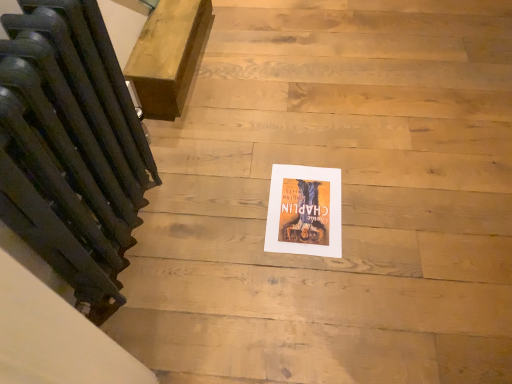
Question: Would you say matte paper poster at center is inside or outside matte black radiator at left?

Choices:
 (A) outside
 (B) inside

Answer: (A)

Question: Looking at the image, does matte paper poster at center seem bigger or smaller compared to matte black radiator at left?

Choices:
 (A) big
 (B) small

Answer: (B)

Question: Based on their relative distances, which object is nearer to the matte black radiator at left?

Choices:
 (A) matte paper poster at center
 (B) wooden bench at upper left

Answer: (B)

Question: Considering the real-world distances, which object is farthest from the matte black radiator at left?

Choices:
 (A) wooden bench at upper left
 (B) matte paper poster at center

Answer: (B)